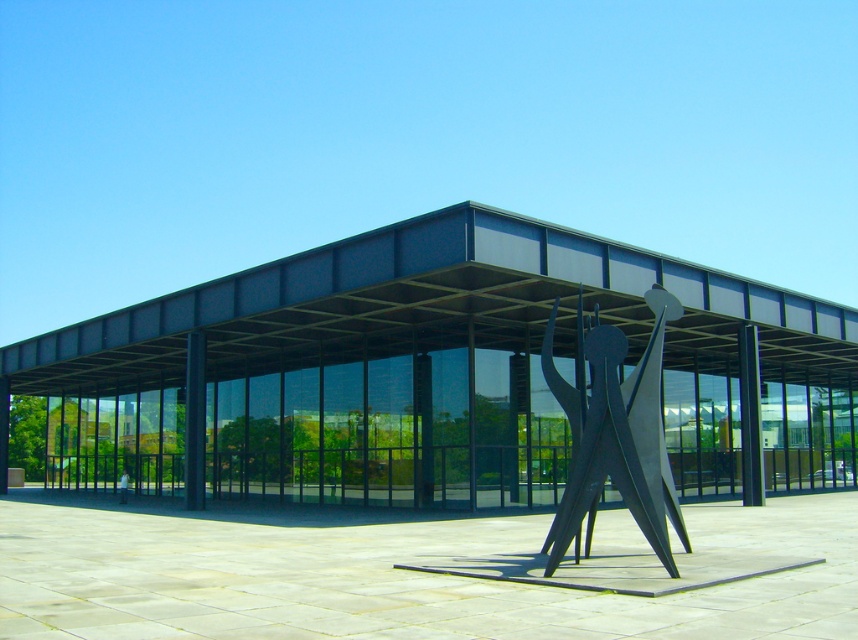
You are an architect designing a new public space. You want to place a bench in the scene so that it is both near the smooth concrete plaza at center and not directly under the polished steel sculpture at center. Where should you place the bench?

The bench should be placed near the smooth concrete plaza at center but not directly under the polished steel sculpture at center. Since the smooth concrete plaza at center is positioned under the polished steel sculpture at center, the bench can be placed on the edge of the plaza away from the sculpture to avoid being under it while still being close to the plaza.

You are an architect designing a new plaza and want to ensure proper lighting for the polished steel sculpture at center and the black metal canopy at center. Based on the scene, which object is positioned lower and might require additional lighting from above?

The black metal canopy at center is located below the polished steel sculpture at center, so it might require additional lighting from above to ensure it is properly illuminated.